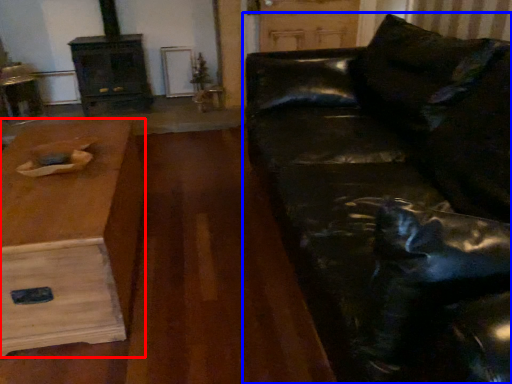
Question: Which point is closer to the camera, table (highlighted by a red box) or studio couch (highlighted by a blue box)?

Choices:
 (A) table
 (B) studio couch

Answer: (B)